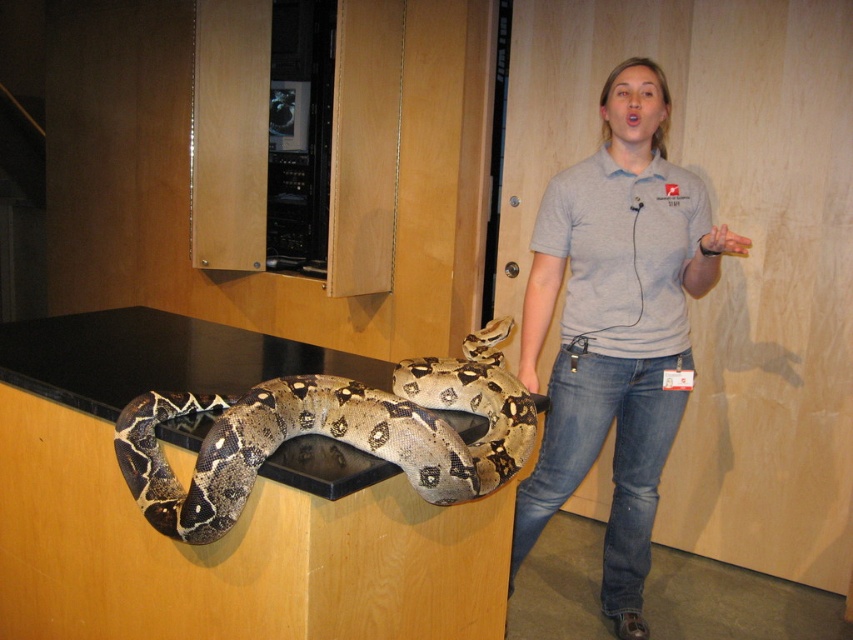
Question: Does gray cotton shirt at center have a greater width compared to brown patterned snake at center?

Choices:
 (A) no
 (B) yes

Answer: (A)

Question: Which point is farther to the camera?

Choices:
 (A) (630, 204)
 (B) (360, 424)

Answer: (A)

Question: Can you confirm if gray cotton shirt at center is positioned below brown patterned snake at center?

Choices:
 (A) yes
 (B) no

Answer: (B)

Question: Can you confirm if gray cotton shirt at center is positioned to the left of brown patterned snake at center?

Choices:
 (A) no
 (B) yes

Answer: (A)

Question: Which of the following is the closest to the observer?

Choices:
 (A) brown patterned snake at center
 (B) gray cotton shirt at center

Answer: (A)